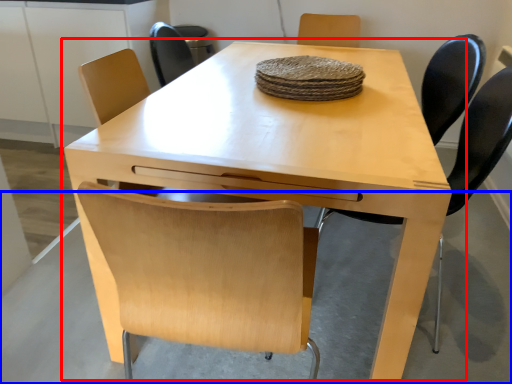
Question: Which object appears closest to the camera in this image, table (highlighted by a red box) or concrete (highlighted by a blue box)?

Choices:
 (A) table
 (B) concrete

Answer: (A)